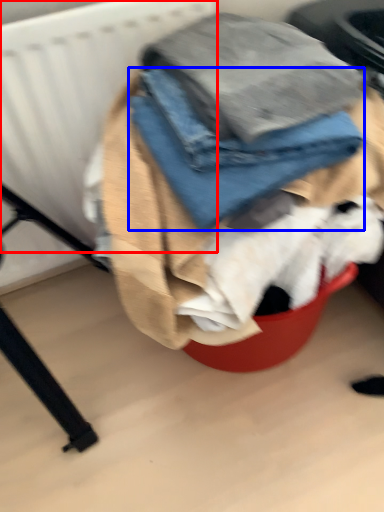
Question: Which object appears closest to the camera in this image, radiator (highlighted by a red box) or trousers (highlighted by a blue box)?

Choices:
 (A) radiator
 (B) trousers

Answer: (B)